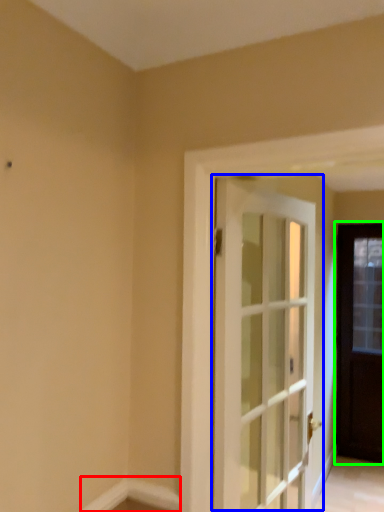
Question: Based on their relative distances, which object is nearer to molding (highlighted by a red box)? Choose from door (highlighted by a blue box) and door (highlighted by a green box).

Choices:
 (A) door
 (B) door

Answer: (A)